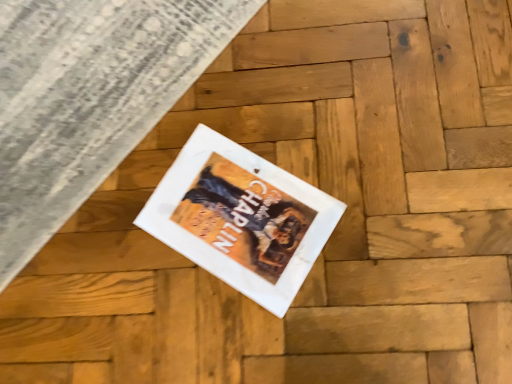
Find the location of a particular element. vacant area situated to the left side of white matte picture frame at center is located at coordinates (119, 266).